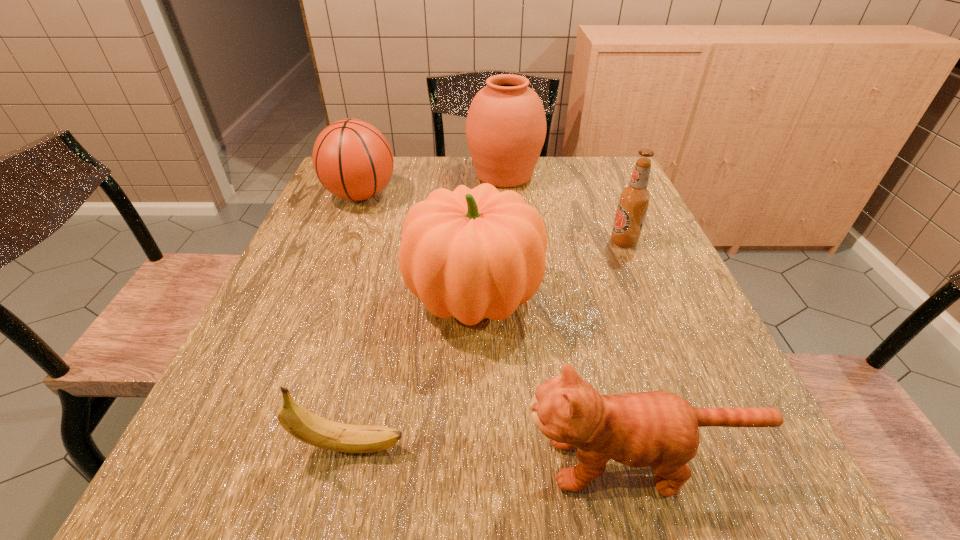
Where is `basketball located in the left edge section of the desktop`? The width and height of the screenshot is (960, 540). basketball located in the left edge section of the desktop is located at coordinates (352, 159).

You are a GUI agent. You are given a task and a screenshot of the screen. Output one action in this format:
    pyautogui.click(x=<x>, y=<y>)
    Task: Click on the banana that is at the left edge
    The width and height of the screenshot is (960, 540).
    Given the screenshot: What is the action you would take?
    pyautogui.click(x=305, y=426)

Locate an element on the screen. This screenshot has height=540, width=960. beer bottle that is positioned at the right edge is located at coordinates (634, 199).

At what (x,y) coordinates should I click in order to perform the action: click on cat that is positioned at the right edge. Please return your answer as a coordinate pair (x, y). The height and width of the screenshot is (540, 960). Looking at the image, I should click on (659, 429).

I want to click on object situated at the far left corner, so click(x=352, y=159).

I want to click on object situated at the near left corner, so click(x=305, y=426).

At what (x,y) coordinates should I click in order to perform the action: click on object at the near right corner. Please return your answer as a coordinate pair (x, y). This screenshot has height=540, width=960. Looking at the image, I should click on click(x=659, y=429).

This screenshot has width=960, height=540. I want to click on vacant space at the left edge, so click(x=313, y=244).

In the image, there is a desktop. Where is `vacant space at the right edge`? This screenshot has width=960, height=540. vacant space at the right edge is located at coordinates (669, 379).

What are the coordinates of `free spot at the far right corner of the desktop` in the screenshot? It's located at (x=594, y=161).